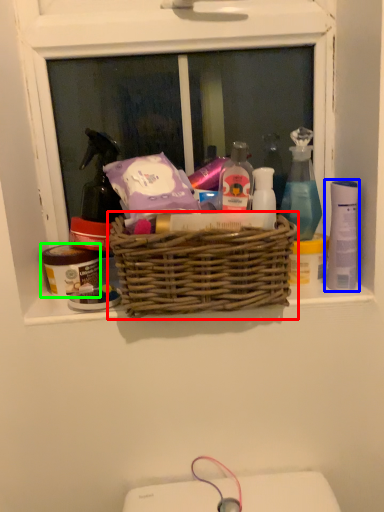
Question: Which object is the closest to the picnic basket (highlighted by a red box)? Choose among these: mouthwash (highlighted by a blue box) or toiletry (highlighted by a green box).

Choices:
 (A) mouthwash
 (B) toiletry

Answer: (B)